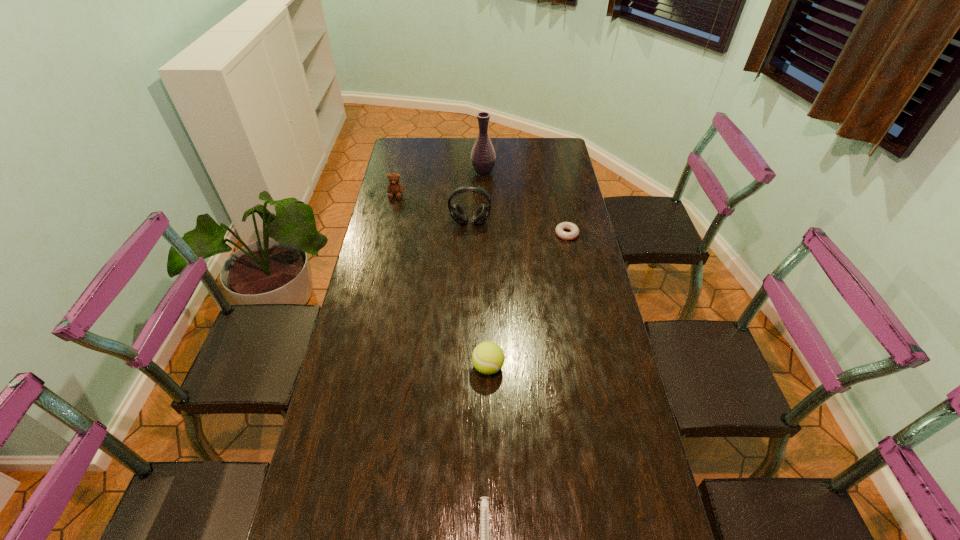
You are a GUI agent. You are given a task and a screenshot of the screen. Output one action in this format:
    pyautogui.click(x=<x>, y=<y>)
    Task: Click on the vacant position located on the face of the leftmost object
    This screenshot has width=960, height=540.
    Given the screenshot: What is the action you would take?
    pyautogui.click(x=394, y=208)

The image size is (960, 540). What are the coordinates of `vacant space located on the back of the tennis ball` in the screenshot? It's located at (487, 271).

This screenshot has width=960, height=540. Identify the location of vacant space located 0.120m on the left of the second shortest object. (524, 234).

This screenshot has width=960, height=540. Identify the location of object that is at the left edge. (394, 188).

The width and height of the screenshot is (960, 540). Identify the location of object that is positioned at the right edge. (574, 233).

Image resolution: width=960 pixels, height=540 pixels. I want to click on vacant area at the far edge, so click(510, 140).

In the image, there is a desktop. Where is `vacant region at the left edge`? This screenshot has width=960, height=540. vacant region at the left edge is located at coordinates point(373,356).

In the image, there is a desktop. At what (x,y) coordinates should I click in order to perform the action: click on free space at the right edge. Please return your answer as a coordinate pair (x, y). Image resolution: width=960 pixels, height=540 pixels. Looking at the image, I should click on (567, 335).

This screenshot has width=960, height=540. I want to click on free location at the far left corner of the desktop, so click(x=413, y=154).

This screenshot has width=960, height=540. In order to click on vacant area at the far right corner of the desktop in this screenshot , I will do `click(560, 139)`.